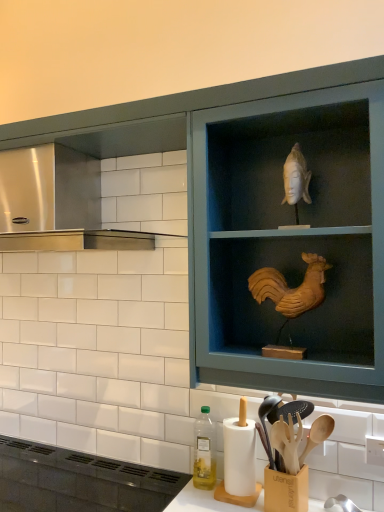
Question: Does wooden rooster at upper right have a smaller size compared to stainless steel vent at upper left?

Choices:
 (A) no
 (B) yes

Answer: (A)

Question: Is wooden rooster at upper right next to stainless steel vent at upper left?

Choices:
 (A) yes
 (B) no

Answer: (B)

Question: Is the depth of wooden rooster at upper right greater than that of stainless steel vent at upper left?

Choices:
 (A) yes
 (B) no

Answer: (B)

Question: Is wooden rooster at upper right positioned in front of stainless steel vent at upper left?

Choices:
 (A) no
 (B) yes

Answer: (B)

Question: From a real-world perspective, does wooden rooster at upper right stand above stainless steel vent at upper left?

Choices:
 (A) yes
 (B) no

Answer: (B)

Question: Considering the relative sizes of wooden rooster at upper right and stainless steel vent at upper left in the image provided, is wooden rooster at upper right bigger than stainless steel vent at upper left?

Choices:
 (A) yes
 (B) no

Answer: (A)

Question: Is matte black vent at lower left to the left of wooden spoons at lower center from the viewer's perspective?

Choices:
 (A) no
 (B) yes

Answer: (B)

Question: Is matte black vent at lower left completely or partially outside of wooden spoons at lower center?

Choices:
 (A) no
 (B) yes

Answer: (B)

Question: Is matte black vent at lower left far from wooden spoons at lower center?

Choices:
 (A) no
 (B) yes

Answer: (A)

Question: From a real-world perspective, is matte black vent at lower left positioned under wooden spoons at lower center based on gravity?

Choices:
 (A) yes
 (B) no

Answer: (A)

Question: Is matte black vent at lower left in front of wooden spoons at lower center?

Choices:
 (A) no
 (B) yes

Answer: (B)

Question: Can you see matte black vent at lower left touching wooden spoons at lower center?

Choices:
 (A) no
 (B) yes

Answer: (A)

Question: Can you confirm if matte black vent at lower left is shorter than wooden cabinet at upper center?

Choices:
 (A) no
 (B) yes

Answer: (B)